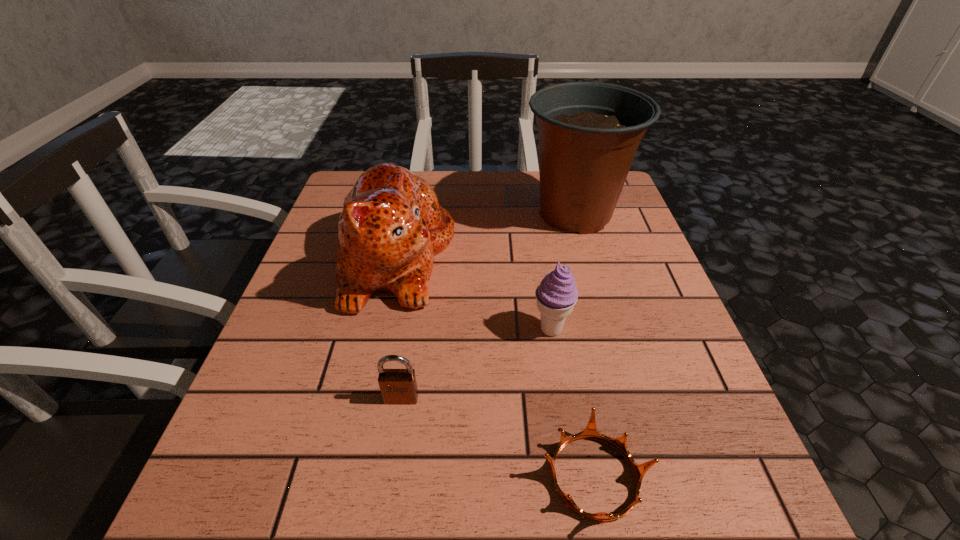
The image size is (960, 540). Identify the location of vacant position in the image that satisfies the following two spatial constraints: 1. on the face of the fourth shortest object; 2. on the left side of the shortest object. (347, 477).

Where is `vacant position in the image that satisfies the following two spatial constraints: 1. on the back side of the third tallest object; 2. on the face of the second tallest object`? vacant position in the image that satisfies the following two spatial constraints: 1. on the back side of the third tallest object; 2. on the face of the second tallest object is located at coordinates (540, 257).